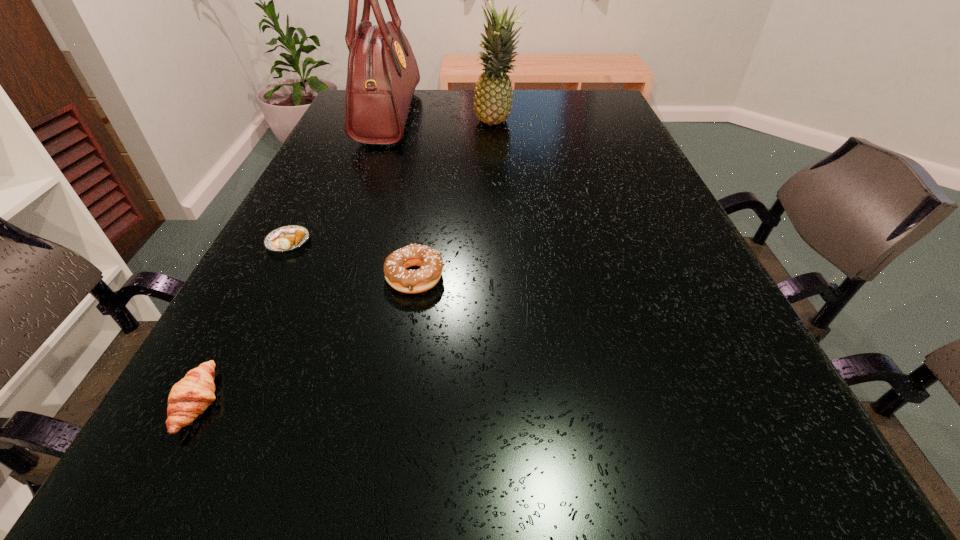
You are a GUI agent. You are given a task and a screenshot of the screen. Output one action in this format:
    pyautogui.click(x=<x>, y=<y>)
    Task: Click on the free space between the nearer pastry and the doughnut
    The image size is (960, 540).
    Given the screenshot: What is the action you would take?
    pyautogui.click(x=307, y=340)

Locate an element on the screen. This screenshot has height=540, width=960. vacant area that lies between the fourth farthest object and the farther pastry is located at coordinates (351, 260).

I want to click on free space between the doughnut and the second tallest object, so click(456, 200).

This screenshot has height=540, width=960. I want to click on object that is the third closest to the tallest object, so click(430, 261).

Locate which object ranks fourth in proximity to the fourth shortest object. Please provide its 2D coordinates. Your answer should be formatted as a tuple, i.e. [(x, y)], where the tuple contains the x and y coordinates of a point satisfying the conditions above.

[(189, 398)]

You are a GUI agent. You are given a task and a screenshot of the screen. Output one action in this format:
    pyautogui.click(x=<x>, y=<y>)
    Task: Click on the vacant area that satisfies the following two spatial constraints: 1. on the front side of the rightmost object; 2. on the front-facing side of the nearer pastry
    This screenshot has height=540, width=960.
    Given the screenshot: What is the action you would take?
    pyautogui.click(x=516, y=402)

At what (x,y) coordinates should I click in order to perform the action: click on free space that satisfies the following two spatial constraints: 1. on the front side of the shorter pastry; 2. on the right side of the doughnut. Please return your answer as a coordinate pair (x, y). This screenshot has height=540, width=960. Looking at the image, I should click on (271, 277).

At what (x,y) coordinates should I click in order to perform the action: click on vacant space that satisfies the following two spatial constraints: 1. on the back side of the rightmost object; 2. on the right side of the shortest object. Please return your answer as a coordinate pair (x, y). Looking at the image, I should click on (348, 123).